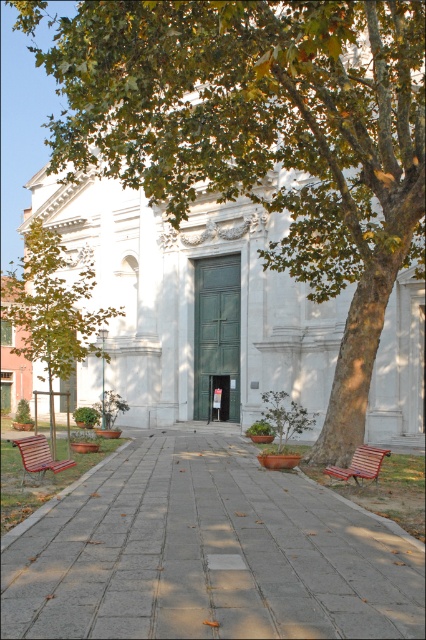
Can you confirm if green leafy tree at center is smaller than wooden park bench at lower left?

No.

Is green leafy tree at center to the right of wooden park bench at lower left from the viewer's perspective?

No, green leafy tree at center is not to the right of wooden park bench at lower left.

Locate an element on the screen. green leafy tree at center is located at coordinates (51, 310).

Is point (284, 218) closer to viewer compared to point (25, 259)?

Yes, it is in front of point (25, 259).

Between point (279, 298) and point (46, 360), which one is positioned behind?

The point (279, 298) is more distant.

Locate an element on the screen. The image size is (426, 640). white stone church at center is located at coordinates (193, 300).

Who is positioned more to the left, paved stone walkway at center or white stone church at center?

Positioned to the left is white stone church at center.

Identify the location of paved stone walkway at center. (207, 554).